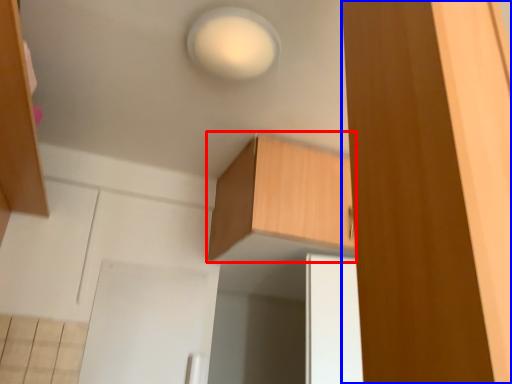
Question: Which point is closer to the camera, cabinetry (highlighted by a red box) or cabinetry (highlighted by a blue box)?

Choices:
 (A) cabinetry
 (B) cabinetry

Answer: (B)